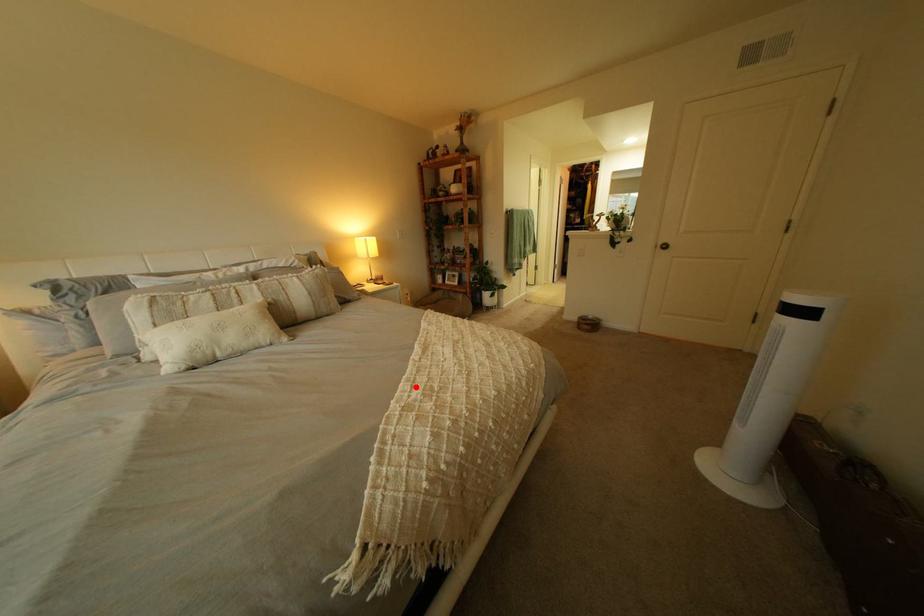
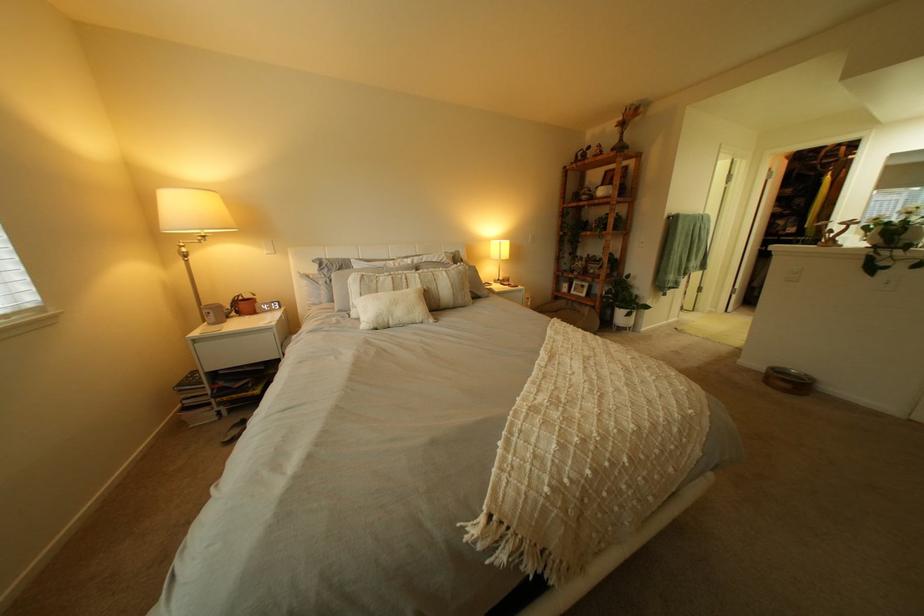
Question: I am providing you with two images of the same scene from different viewpoints. A red point is marked on the first image. Is the red point's position out of view in image 2?

Choices:
 (A) Yes
 (B) No

Answer: (B)